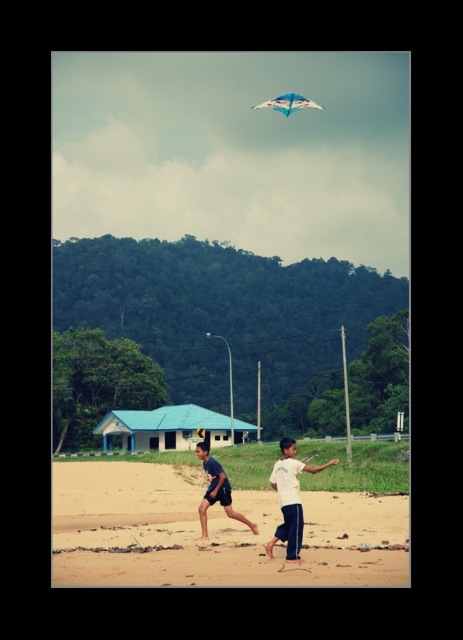
Who is more distant from viewer, (x=319, y=470) or (x=306, y=99)?

The point (x=306, y=99) is more distant.

Does point (295, 513) lie behind point (269, 102)?

That is False.

What are the coordinates of `white cotton shirt at center` in the screenshot? It's located at (289, 499).

Between point (317, 570) and point (288, 512), which one is positioned in front?

Point (317, 570)

Can you confirm if sandy beach at lower center is thinner than white cotton shirt at center?

In fact, sandy beach at lower center might be wider than white cotton shirt at center.

The height and width of the screenshot is (640, 463). I want to click on sandy beach at lower center, so pyautogui.click(x=213, y=532).

Where is `sandy beach at lower center`? This screenshot has width=463, height=640. sandy beach at lower center is located at coordinates (213, 532).

Between dark blue fabric shorts at center and translucent blue kite at upper center, which one has less height?

dark blue fabric shorts at center

Is dark blue fabric shorts at center below translucent blue kite at upper center?

Yes, dark blue fabric shorts at center is below translucent blue kite at upper center.

Where is `dark blue fabric shorts at center`? This screenshot has height=640, width=463. dark blue fabric shorts at center is located at coordinates (217, 490).